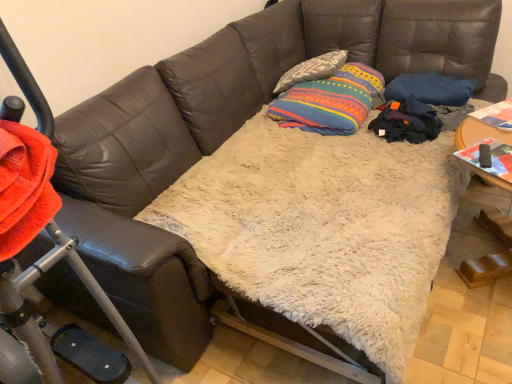
Where is `textured gray pillow at upper center`? textured gray pillow at upper center is located at coordinates (312, 70).

What do you see at coordinates (312, 70) in the screenshot? I see `textured gray pillow at upper center` at bounding box center [312, 70].

Describe the element at coordinates (331, 101) in the screenshot. I see `multicolored striped fabric at center` at that location.

What is the approximate width of multicolored striped fabric at center?

Result: The width of multicolored striped fabric at center is 20.11 inches.

This screenshot has width=512, height=384. In order to click on multicolored striped fabric at center in this screenshot , I will do `click(331, 101)`.

Identify the location of textured gray pillow at upper center. The height and width of the screenshot is (384, 512). (312, 70).

Based on their positions, is textured gray pillow at upper center located to the left or right of multicolored striped fabric at center?

Clearly, textured gray pillow at upper center is on the left of multicolored striped fabric at center in the image.

Is the depth of textured gray pillow at upper center less than that of multicolored striped fabric at center?

No, textured gray pillow at upper center is further to the viewer.

Is point (291, 80) less distant than point (332, 131)?

No, (291, 80) is behind (332, 131).

From the image's perspective, between textured gray pillow at upper center and multicolored striped fabric at center, who is located below?

From the image's view, multicolored striped fabric at center is below.

From a real-world perspective, which object stands above the other?

From a 3D spatial view, textured gray pillow at upper center is above.

Considering the sizes of objects textured gray pillow at upper center and multicolored striped fabric at center in the image provided, who is thinner, textured gray pillow at upper center or multicolored striped fabric at center?

Thinner between the two is textured gray pillow at upper center.

Considering the sizes of objects textured gray pillow at upper center and multicolored striped fabric at center in the image provided, who is taller, textured gray pillow at upper center or multicolored striped fabric at center?

multicolored striped fabric at center is taller.

In terms of size, does textured gray pillow at upper center appear bigger or smaller than multicolored striped fabric at center?

Considering their sizes, textured gray pillow at upper center takes up less space than multicolored striped fabric at center.

Is textured gray pillow at upper center completely or partially outside of multicolored striped fabric at center?

Yes, textured gray pillow at upper center is outside of multicolored striped fabric at center.

Is the surface of textured gray pillow at upper center in direct contact with multicolored striped fabric at center?

textured gray pillow at upper center and multicolored striped fabric at center are clearly separated.

Based on the photo, is textured gray pillow at upper center oriented away from multicolored striped fabric at center?

textured gray pillow at upper center is not turned away from multicolored striped fabric at center.

What's the angular difference between textured gray pillow at upper center and multicolored striped fabric at center's facing directions?

textured gray pillow at upper center and multicolored striped fabric at center are facing 11.6 degrees away from each other.

The height and width of the screenshot is (384, 512). What are the coordinates of `throw pillow lying on the right of textured gray pillow at upper center` in the screenshot? It's located at 331,101.

Is multicolored striped fabric at center to the right of textured gray pillow at upper center from the viewer's perspective?

Yes, multicolored striped fabric at center is to the right of textured gray pillow at upper center.

Considering the positions of objects multicolored striped fabric at center and textured gray pillow at upper center in the image provided, who is in front, multicolored striped fabric at center or textured gray pillow at upper center?

multicolored striped fabric at center is in front.

Considering the positions of points (312, 107) and (345, 54), is point (312, 107) closer to camera compared to point (345, 54)?

That is True.

From the image's perspective, between multicolored striped fabric at center and textured gray pillow at upper center, which one is located above?

textured gray pillow at upper center, from the image's perspective.

From a real-world perspective, between multicolored striped fabric at center and textured gray pillow at upper center, who is vertically higher?

textured gray pillow at upper center, from a real-world perspective.

Considering the relative sizes of multicolored striped fabric at center and textured gray pillow at upper center in the image provided, is multicolored striped fabric at center thinner than textured gray pillow at upper center?

No, multicolored striped fabric at center is not thinner than textured gray pillow at upper center.

Who is taller, multicolored striped fabric at center or textured gray pillow at upper center?

With more height is multicolored striped fabric at center.

Which of these two, multicolored striped fabric at center or textured gray pillow at upper center, is smaller?

Smaller between the two is textured gray pillow at upper center.

Is textured gray pillow at upper center inside multicolored striped fabric at center?

Actually, textured gray pillow at upper center is outside multicolored striped fabric at center.

Is multicolored striped fabric at center not close to textured gray pillow at upper center?

They are positioned close to each other.

Is multicolored striped fabric at center oriented away from textured gray pillow at upper center?

multicolored striped fabric at center is not turned away from textured gray pillow at upper center.

How many degrees apart are the facing directions of multicolored striped fabric at center and textured gray pillow at upper center?

The facing directions of multicolored striped fabric at center and textured gray pillow at upper center are 11.6 degrees apart.

How much distance is there between multicolored striped fabric at center and textured gray pillow at upper center?

multicolored striped fabric at center is 7.41 inches away from textured gray pillow at upper center.

Locate an element on the screen. throw pillow to the right of textured gray pillow at upper center is located at coordinates (331, 101).

Locate an element on the screen. The image size is (512, 384). throw pillow beneath the textured gray pillow at upper center (from a real-world perspective) is located at coordinates (331, 101).

Identify the location of pillow that is behind the multicolored striped fabric at center. (312, 70).